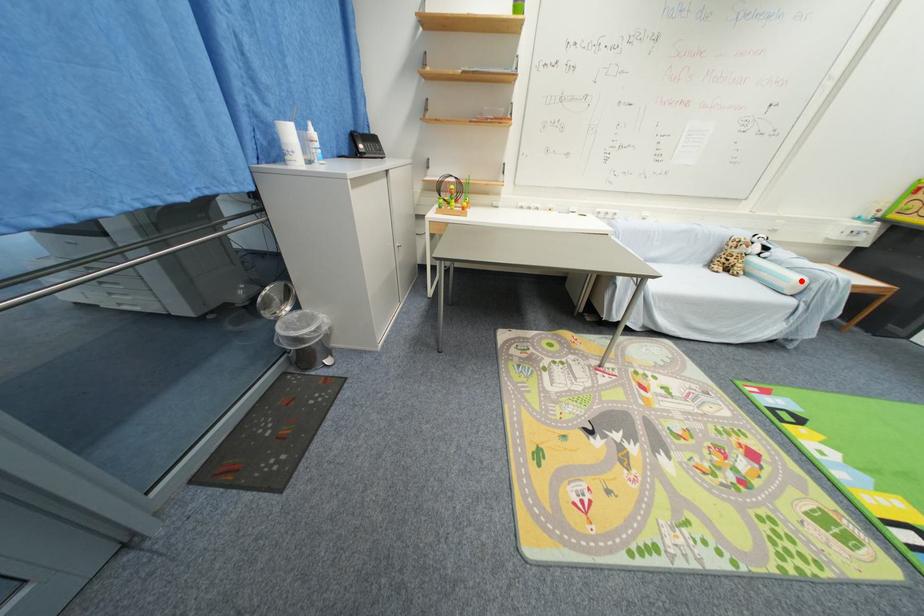
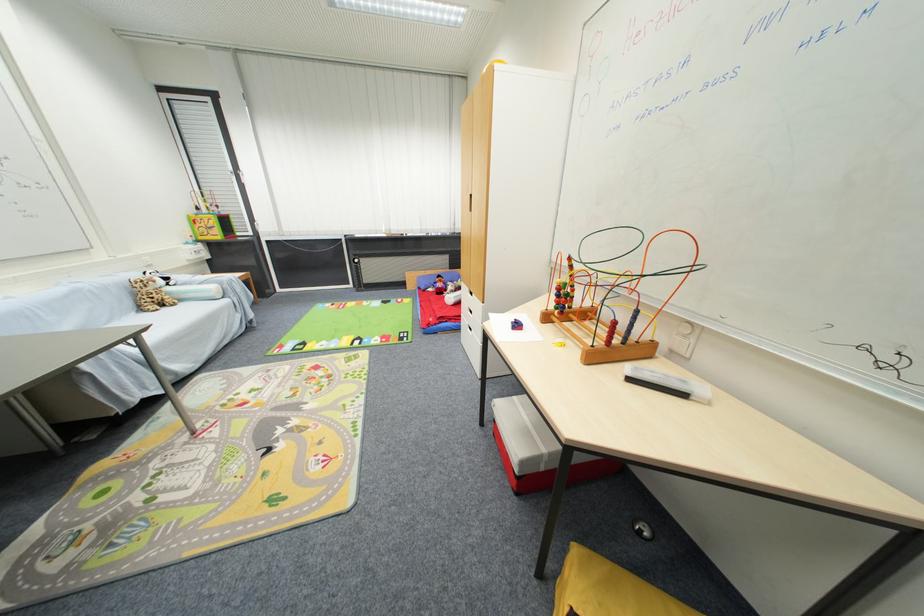
The point at the highlighted location is marked in the first image. Where is the corresponding point in the second image?

(217, 290)